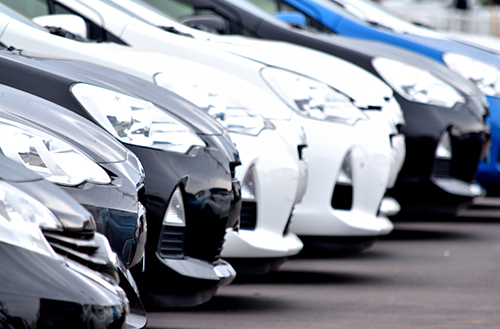
Locate an element on the screen. The width and height of the screenshot is (500, 329). hood is located at coordinates (26, 115), (115, 80), (211, 78), (324, 70), (374, 49), (429, 43), (477, 38).